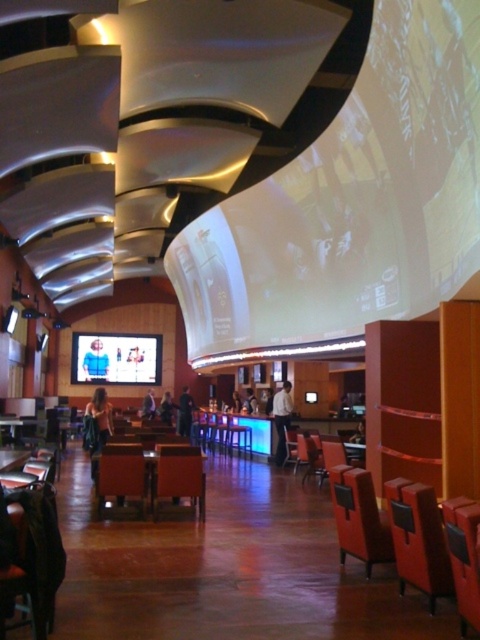
Between dark brown leather jacket at bar and dark blue shirt at center, which one is positioned higher?

dark blue shirt at center is above.

Can you confirm if dark brown leather jacket at bar is taller than dark blue shirt at center?

Correct, dark brown leather jacket at bar is much taller as dark blue shirt at center.

This screenshot has height=640, width=480. I want to click on dark brown leather jacket at bar, so click(x=251, y=401).

How much distance is there between matte brown armchair at center and dark gray suit at center?

matte brown armchair at center and dark gray suit at center are 10.83 meters apart from each other.

Can you confirm if matte brown armchair at center is positioned to the left of dark gray suit at center?

No, matte brown armchair at center is not to the left of dark gray suit at center.

Is point (190, 472) farther from viewer compared to point (153, 397)?

No, it is in front of (153, 397).

Find the location of a particular element. matte brown armchair at center is located at coordinates (179, 476).

Between matte brown armchair at center and dark brown leather jacket at bar, which one has less height?

dark brown leather jacket at bar

Measure the distance between point (170,468) and camera.

Point (170,468) is 24.30 feet away from camera.

At what (x,y) coordinates should I click in order to perform the action: click on matte brown armchair at center. Please return your answer as a coordinate pair (x, y). The height and width of the screenshot is (640, 480). Looking at the image, I should click on (179, 476).